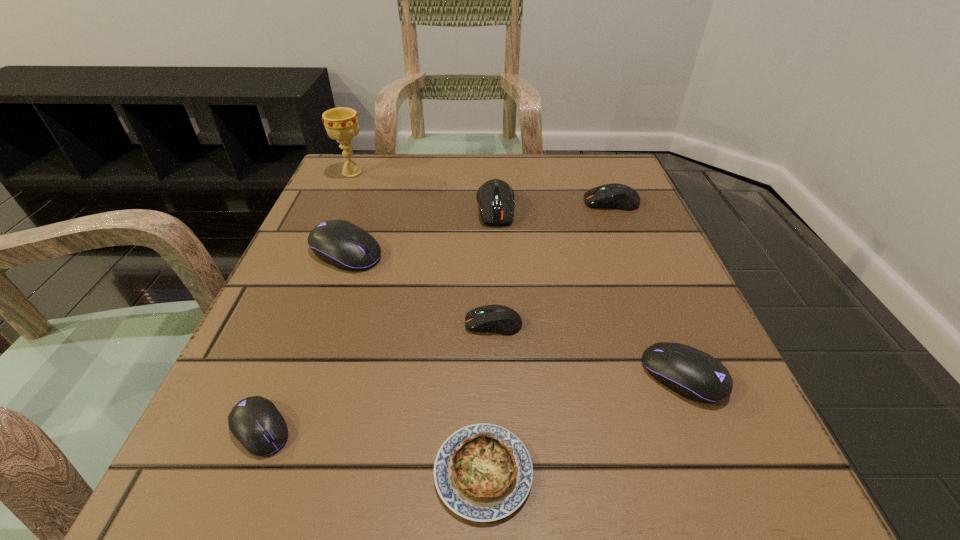
Locate an element on the screen. This screenshot has width=960, height=540. free space between the biggest dark computer equipment and the tallest object is located at coordinates (423, 190).

At what (x,y) coordinates should I click in order to perform the action: click on free space between the shortest object and the fourth farthest computer mouse. Please return your answer as a coordinate pair (x, y). Looking at the image, I should click on (489, 398).

Locate an element on the screen. This screenshot has width=960, height=540. vacant space that is in between the rightmost black computer mouse and the biggest dark computer equipment is located at coordinates (589, 292).

Identify the location of free space between the biggest black computer mouse and the smallest black computer mouse. This screenshot has height=540, width=960. tap(303, 341).

Where is `free space between the biggest dark computer equipment and the smallest black computer mouse`? free space between the biggest dark computer equipment and the smallest black computer mouse is located at coordinates (378, 318).

Locate an element on the screen. This screenshot has height=540, width=960. free spot between the rightmost dark computer equipment and the quiche is located at coordinates (547, 338).

The width and height of the screenshot is (960, 540). Identify the location of object that stands as the seventh closest to the fourth nearest object. (341, 124).

Identify the location of the seventh closest object to the quiche. (341, 124).

Find the location of a particular element. Image resolution: width=960 pixels, height=540 pixels. computer mouse that is the third closest one to the quiche is located at coordinates (255, 422).

Find the location of a particular element. This screenshot has width=960, height=540. computer mouse that is the fifth closest to the biggest dark computer equipment is located at coordinates (255, 422).